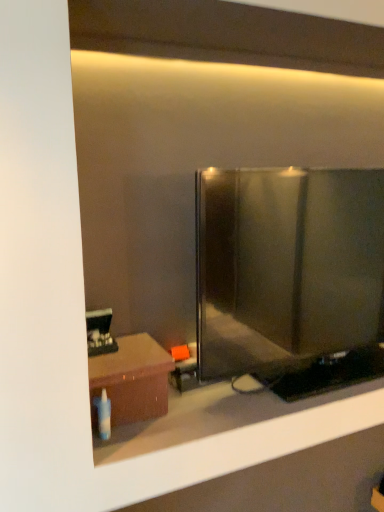
Question: From the image's perspective, relative to matte black glass door at center, is brown matte table at lower left above or below?

Choices:
 (A) below
 (B) above

Answer: (A)

Question: In terms of size, does brown matte table at lower left appear bigger or smaller than matte black glass door at center?

Choices:
 (A) small
 (B) big

Answer: (A)

Question: Considering the relative positions of brown matte table at lower left and matte black glass door at center in the image provided, is brown matte table at lower left to the left or to the right of matte black glass door at center?

Choices:
 (A) right
 (B) left

Answer: (B)

Question: From a real-world perspective, is matte black glass door at center positioned above or below brown matte table at lower left?

Choices:
 (A) below
 (B) above

Answer: (B)

Question: Considering the positions of matte black glass door at center and brown matte table at lower left in the image, is matte black glass door at center bigger or smaller than brown matte table at lower left?

Choices:
 (A) small
 (B) big

Answer: (B)

Question: Considering the positions of point (379, 326) and point (140, 396), is point (379, 326) closer or farther from the camera than point (140, 396)?

Choices:
 (A) closer
 (B) farther

Answer: (B)

Question: From the image's perspective, is matte black glass door at center located above or below brown matte table at lower left?

Choices:
 (A) below
 (B) above

Answer: (B)